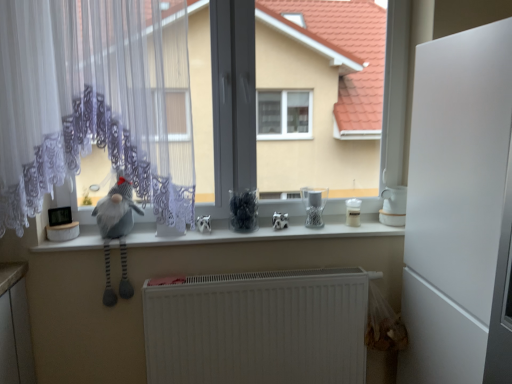
This screenshot has width=512, height=384. Describe the element at coordinates (258, 327) in the screenshot. I see `white matte radiator at lower center` at that location.

What are the coordinates of `white lace curtain at left` in the screenshot? It's located at (94, 100).

Identify the location of white plastic container at center, which is the 2th appliance from right to left. (353, 212).

Describe the element at coordinates (94, 101) in the screenshot. I see `white lace curtain at left` at that location.

Identify the location of clear glass jar at center, marked as the first appliance in a left-to-right arrangement. (314, 205).

Is white matte refrigerator at right inside or outside of white glossy counter top at center?

white matte refrigerator at right is located beyond the bounds of white glossy counter top at center.

Between point (492, 282) and point (176, 239), which one is positioned in front?

The point (492, 282) is closer.

From the image's perspective, relative to white glossy counter top at center, is white matte refrigerator at right above or below?

Clearly, from the image's perspective, white matte refrigerator at right is below white glossy counter top at center.

Is white matte refrigerator at right oriented away from white glossy counter top at center?

That's not correct — white matte refrigerator at right is not looking away from white glossy counter top at center.

Which object is thinner, gray fabric gnome at left or white lace curtain at left?

With smaller width is white lace curtain at left.

Considering the sizes of objects gray fabric gnome at left and white lace curtain at left in the image provided, who is bigger, gray fabric gnome at left or white lace curtain at left?

white lace curtain at left.

Considering the positions of point (117, 209) and point (148, 36), is point (117, 209) closer or farther from the camera than point (148, 36)?

Point (117, 209) appears to be farther away from the viewer than point (148, 36).

Is gray fabric gnome at left shorter than white lace curtain at left?

Correct, gray fabric gnome at left is not as tall as white lace curtain at left.

Considering the relative positions of white plastic container at center, which is the 2th appliance in left-to-right order, and white glossy teapot at right, the first appliance positioned from the right, in the image provided, is white plastic container at center, which is the 2th appliance in left-to-right order, to the left or to the right of white glossy teapot at right, the first appliance positioned from the right,?

white plastic container at center, which is the 2th appliance in left-to-right order, is to the left of white glossy teapot at right, the first appliance positioned from the right.

Choose the correct answer: Is white plastic container at center, which is the 2th appliance in left-to-right order, inside white glossy teapot at right, acting as the third appliance starting from the left, or outside it?

white plastic container at center, which is the 2th appliance in left-to-right order, is not enclosed by white glossy teapot at right, acting as the third appliance starting from the left.

Is point (357, 211) positioned in front of point (384, 198)?

No, (357, 211) is further to viewer.

Identify the location of screen door that is in front of the white glossy teapot at right, the first appliance positioned from the right. This screenshot has height=384, width=512. (459, 210).

In the scene shown: Is white glossy teapot at right, the first appliance positioned from the right, inside the boundaries of white matte refrigerator at right, or outside?

white glossy teapot at right, the first appliance positioned from the right, is spatially situated outside white matte refrigerator at right.

Is white glossy teapot at right, the first appliance positioned from the right, next to white matte refrigerator at right and touching it?

white glossy teapot at right, the first appliance positioned from the right, is not next to white matte refrigerator at right, and they're not touching.

Is white glossy teapot at right, the first appliance positioned from the right, turned away from white matte refrigerator at right?

No, white matte refrigerator at right is not at the back of white glossy teapot at right, the first appliance positioned from the right.

Is white glossy teapot at right, the first appliance positioned from the right, positioned far away from clear glass jar at center, which is counted as the 3th appliance, starting from the right?

white glossy teapot at right, the first appliance positioned from the right, is near clear glass jar at center, which is counted as the 3th appliance, starting from the right, not far away.

Visually, is white glossy teapot at right, acting as the third appliance starting from the left, positioned to the left or to the right of clear glass jar at center, marked as the first appliance in a left-to-right arrangement?

Based on their positions, white glossy teapot at right, acting as the third appliance starting from the left, is located to the right of clear glass jar at center, marked as the first appliance in a left-to-right arrangement.

From a real-world perspective, is white glossy teapot at right, acting as the third appliance starting from the left, positioned over clear glass jar at center, marked as the first appliance in a left-to-right arrangement, based on gravity?

Correct, in the physical world, white glossy teapot at right, acting as the third appliance starting from the left, is higher than clear glass jar at center, marked as the first appliance in a left-to-right arrangement.

Considering their positions, is white matte radiator at lower center located in front of or behind clear glass jar at center, which is counted as the 3th appliance, starting from the right?

white matte radiator at lower center is positioned closer to the viewer than clear glass jar at center, which is counted as the 3th appliance, starting from the right.

Is white matte radiator at lower center at the right side of clear glass jar at center, marked as the first appliance in a left-to-right arrangement?

In fact, white matte radiator at lower center is to the left of clear glass jar at center, marked as the first appliance in a left-to-right arrangement.

Considering the sizes of white matte radiator at lower center and clear glass jar at center, which is counted as the 3th appliance, starting from the right, in the image, is white matte radiator at lower center taller or shorter than clear glass jar at center, which is counted as the 3th appliance, starting from the right,?

white matte radiator at lower center is taller than clear glass jar at center, which is counted as the 3th appliance, starting from the right.

From the image's perspective, which one is positioned lower, white matte radiator at lower center or white lace curtain at left?

white matte radiator at lower center, from the image's perspective.

Which is behind, point (226, 291) or point (169, 108)?

The point (226, 291) is more distant.

Can you confirm if white matte radiator at lower center is taller than white lace curtain at left?

No, white matte radiator at lower center is not taller than white lace curtain at left.

Could white lace curtain at left be considered to be inside white matte radiator at lower center?

That's incorrect, white lace curtain at left is not inside white matte radiator at lower center.

Locate an element on the screen. The height and width of the screenshot is (384, 512). counter top that is under the white matte refrigerator at right (from a real-world perspective) is located at coordinates (266, 232).

Where is `bay window that appears behind the gray fabric gnome at left`? bay window that appears behind the gray fabric gnome at left is located at coordinates (94, 101).

Looking at the image, which one is located further to white plastic container at center, which is the 2th appliance from right to left, white lace curtain at left or white glossy counter top at center?

Among the two, white lace curtain at left is located further to white plastic container at center, which is the 2th appliance from right to left.

From the picture: Looking at the image, which one is located further to white matte refrigerator at right, white matte radiator at lower center or gray fabric gnome at left?

The object further to white matte refrigerator at right is gray fabric gnome at left.

When comparing their distances from white matte refrigerator at right, does white matte radiator at lower center or white glossy counter top at center seem closer?

The object closer to white matte refrigerator at right is white matte radiator at lower center.

Which object lies further to the anchor point white glossy teapot at right, the first appliance positioned from the right, white matte radiator at lower center or gray fabric gnome at left?

→ Based on the image, gray fabric gnome at left appears to be further to white glossy teapot at right, the first appliance positioned from the right.

Which object lies further to the anchor point white lace curtain at left, white matte radiator at lower center or white glossy teapot at right, the first appliance positioned from the right?

The object further to white lace curtain at left is white glossy teapot at right, the first appliance positioned from the right.

Based on their spatial positions, is white lace curtain at left or white matte radiator at lower center closer to white lace curtain at left?

white lace curtain at left is closer to white lace curtain at left.

Considering their positions, is white matte radiator at lower center positioned closer to white matte refrigerator at right than white glossy teapot at right, the first appliance positioned from the right?

white glossy teapot at right, the first appliance positioned from the right, lies closer to white matte refrigerator at right than the other object.

When comparing their distances from white glossy teapot at right, the first appliance positioned from the right, does white glossy counter top at center or white matte radiator at lower center seem further?

The object further to white glossy teapot at right, the first appliance positioned from the right, is white matte radiator at lower center.

You are a GUI agent. You are given a task and a screenshot of the screen. Output one action in this format:
    pyautogui.click(x=<x>, y=<y>)
    Task: Click on the radiator situated between white lace curtain at left and clear glass jar at center, marked as the first appliance in a left-to-right arrangement, from left to right
    The image size is (512, 384).
    Given the screenshot: What is the action you would take?
    pyautogui.click(x=258, y=327)

Where is `radiator situated between white lace curtain at left and white matte refrigerator at right from left to right`? Image resolution: width=512 pixels, height=384 pixels. radiator situated between white lace curtain at left and white matte refrigerator at right from left to right is located at coordinates (258, 327).

You are a GUI agent. You are given a task and a screenshot of the screen. Output one action in this format:
    pyautogui.click(x=<x>, y=<y>)
    Task: Click on the counter top between gray fabric gnome at left and clear glass jar at center, marked as the first appliance in a left-to-right arrangement, from left to right
    This screenshot has width=512, height=384.
    Given the screenshot: What is the action you would take?
    pyautogui.click(x=266, y=232)

At what (x,y) coordinates should I click in order to perform the action: click on counter top situated between white lace curtain at left and white plastic container at center, which is the 2th appliance in left-to-right order, from left to right. Please return your answer as a coordinate pair (x, y). Image resolution: width=512 pixels, height=384 pixels. Looking at the image, I should click on (266, 232).